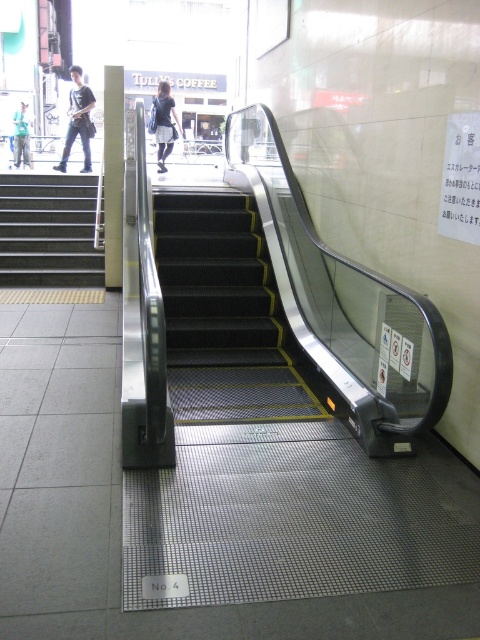
Is point (71, 118) more distant than point (158, 100)?

No, (71, 118) is in front of (158, 100).

Who is more forward, (80, 129) or (157, 124)?

Point (80, 129) is in front.

Locate an element on the screen. The width and height of the screenshot is (480, 640). dark blue jeans at left is located at coordinates (78, 120).

Does black carpeted stairs at center appear on the right side of dark blue jeans at left?

Correct, you'll find black carpeted stairs at center to the right of dark blue jeans at left.

Does point (158, 202) lie behind point (84, 141)?

No, (158, 202) is closer to viewer.

Is point (218, 310) more distant than point (87, 164)?

No, (218, 310) is in front of (87, 164).

In order to click on black carpeted stairs at center in this screenshot , I will do `click(226, 316)`.

Which is in front, point (211, 342) or point (99, 256)?

Point (211, 342) is more forward.

Is black carpeted stairs at center above metallic gray stairs at left?

Actually, black carpeted stairs at center is below metallic gray stairs at left.

Which is behind, point (261, 348) or point (37, 244)?

Point (37, 244)

The image size is (480, 640). I want to click on black carpeted stairs at center, so click(226, 316).